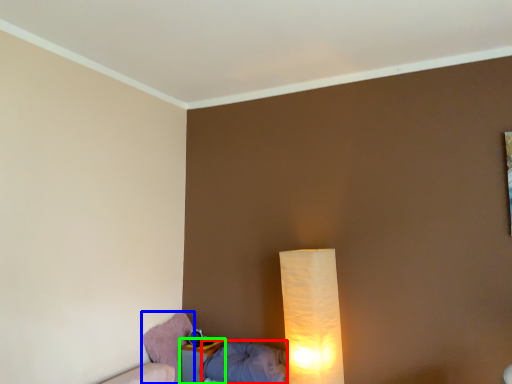
Question: Estimate the real-world distances between objects in this image. Which object is closer to pillow (highlighted by a red box), swivel chair (highlighted by a blue box) or nightstand (highlighted by a green box)?

Choices:
 (A) swivel chair
 (B) nightstand

Answer: (B)